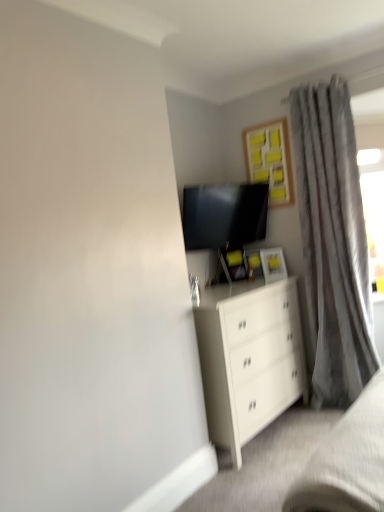
Question: Should I look upward or downward to see matte black tv at upper center?

Choices:
 (A) down
 (B) up

Answer: (B)

Question: Can you confirm if gray textured curtain at right is positioned to the right of wooden frame with yellow sticky notes at upper center?

Choices:
 (A) yes
 (B) no

Answer: (A)

Question: Is gray textured curtain at right next to wooden frame with yellow sticky notes at upper center?

Choices:
 (A) no
 (B) yes

Answer: (A)

Question: Is gray textured curtain at right to the left of wooden frame with yellow sticky notes at upper center from the viewer's perspective?

Choices:
 (A) no
 (B) yes

Answer: (A)

Question: From the image's perspective, is gray textured curtain at right under wooden frame with yellow sticky notes at upper center?

Choices:
 (A) yes
 (B) no

Answer: (A)

Question: Does gray textured curtain at right have a smaller size compared to wooden frame with yellow sticky notes at upper center?

Choices:
 (A) no
 (B) yes

Answer: (A)

Question: Does gray textured curtain at right have a greater height compared to wooden frame with yellow sticky notes at upper center?

Choices:
 (A) yes
 (B) no

Answer: (A)

Question: Are white matte chest of drawers at center and white matte bed frame at lower right far apart?

Choices:
 (A) no
 (B) yes

Answer: (A)

Question: Does white matte chest of drawers at center have a larger size compared to white matte bed frame at lower right?

Choices:
 (A) no
 (B) yes

Answer: (B)

Question: From a real-world perspective, is white matte chest of drawers at center positioned under white matte bed frame at lower right based on gravity?

Choices:
 (A) no
 (B) yes

Answer: (B)

Question: Is white matte bed frame at lower right at the back of white matte chest of drawers at center?

Choices:
 (A) yes
 (B) no

Answer: (B)

Question: Considering the relative sizes of white matte chest of drawers at center and white matte bed frame at lower right in the image provided, is white matte chest of drawers at center shorter than white matte bed frame at lower right?

Choices:
 (A) yes
 (B) no

Answer: (B)

Question: Considering the relative sizes of white matte chest of drawers at center and white matte bed frame at lower right in the image provided, is white matte chest of drawers at center thinner than white matte bed frame at lower right?

Choices:
 (A) yes
 (B) no

Answer: (B)

Question: Does wooden frame with yellow sticky notes at upper center lie in front of matte black tv at upper center?

Choices:
 (A) no
 (B) yes

Answer: (A)